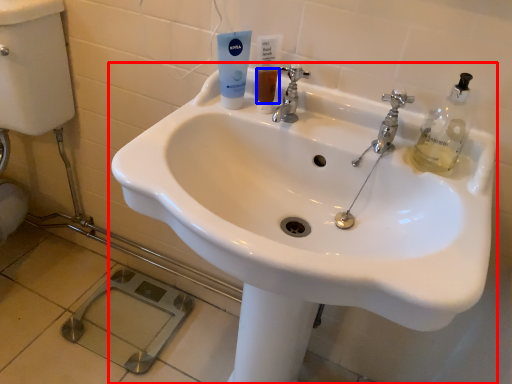
Question: Which object appears farthest to the camera in this image, sink (highlighted by a red box) or liquid (highlighted by a blue box)?

Choices:
 (A) sink
 (B) liquid

Answer: (B)